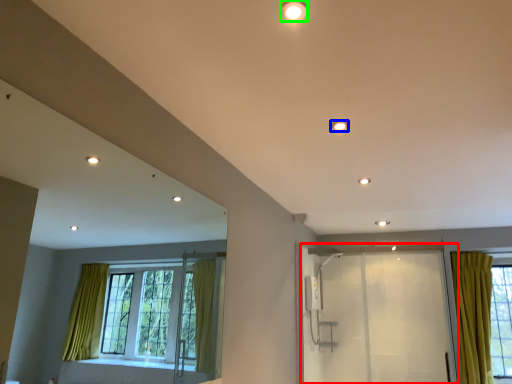
Question: Based on their relative distances, which object is nearer to screen door (highlighted by a red box)? Choose from lighting (highlighted by a blue box) and lighting (highlighted by a green box).

Choices:
 (A) lighting
 (B) lighting

Answer: (A)